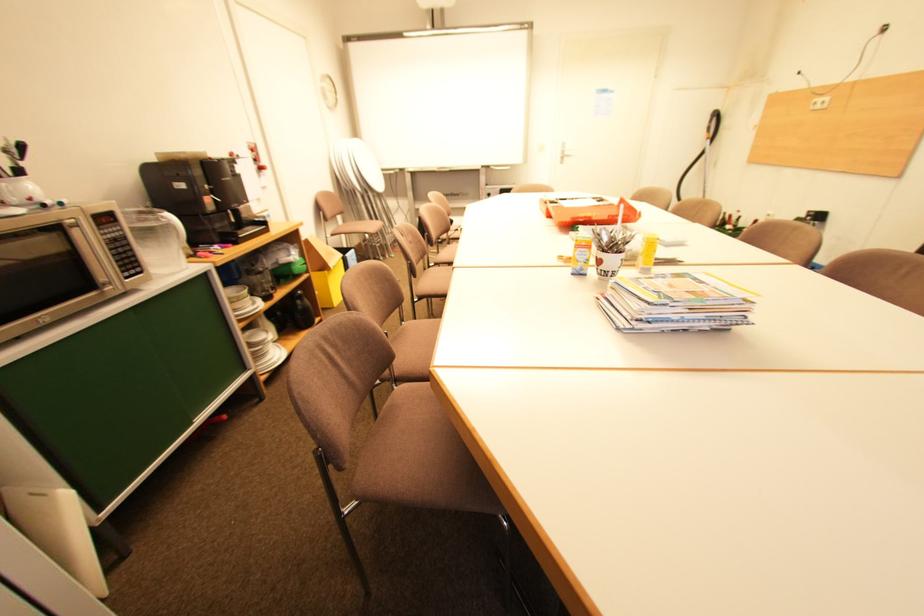
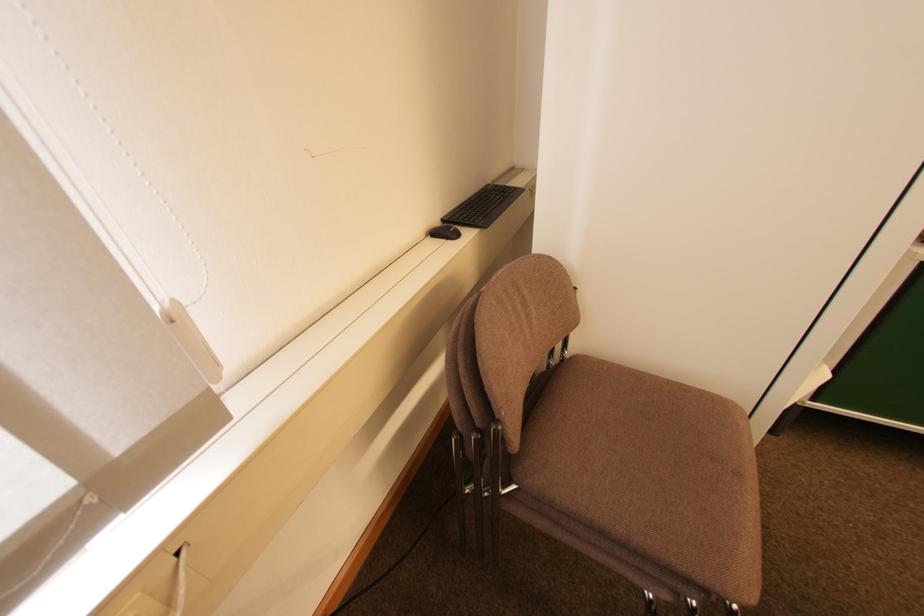
The images are taken continuously from a first-person perspective. In which direction is your viewpoint rotating?

Answer: The camera's rotation is toward left-down.